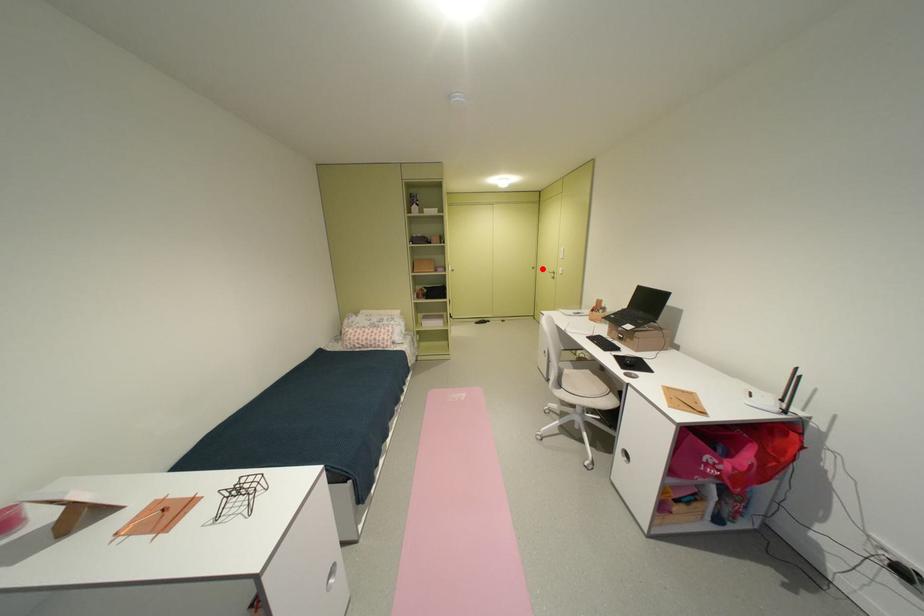
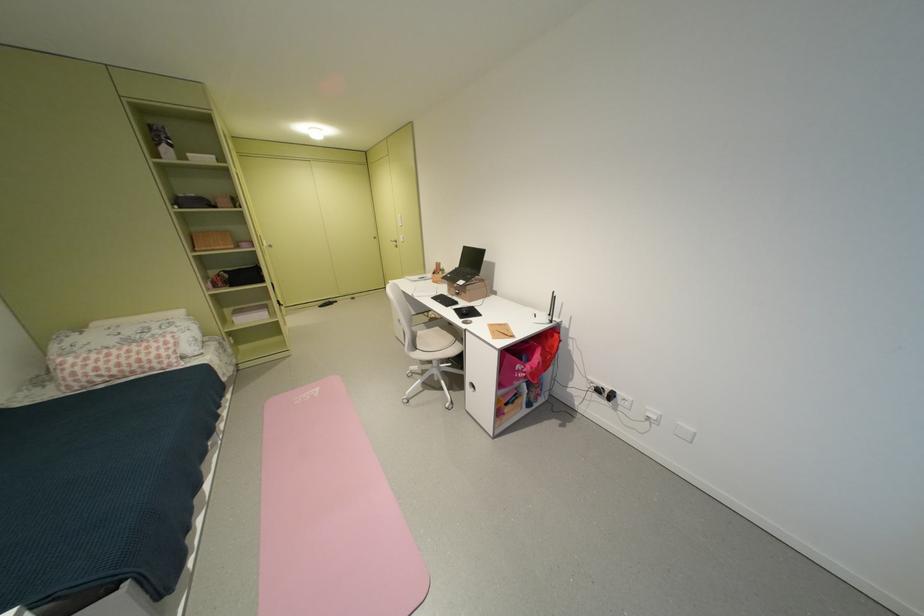
Locate, in the second image, the point that corresponds to the highlighted location in the first image.

(383, 238)